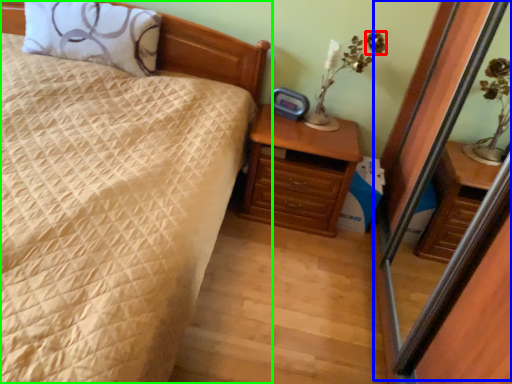
Question: Which is farther away from flower (highlighted by a red box)? screen door (highlighted by a blue box) or bed (highlighted by a green box)?

Choices:
 (A) screen door
 (B) bed

Answer: (B)